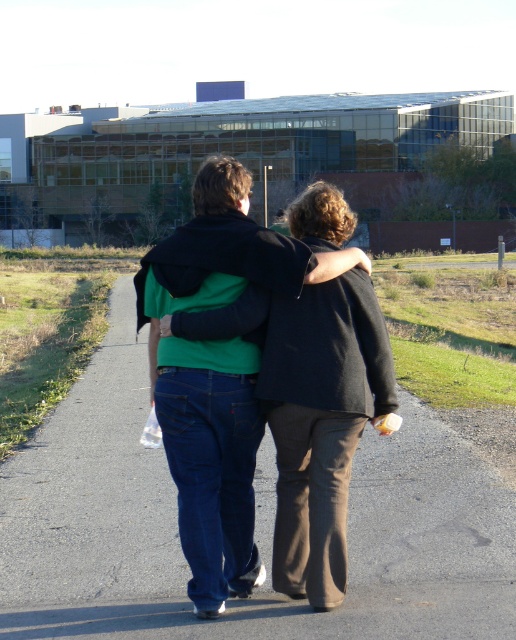
Question: Observing the image, what is the correct spatial positioning of smooth asphalt road at center in reference to green cotton hoodie at center?

Choices:
 (A) below
 (B) above

Answer: (A)

Question: From the image, what is the correct spatial relationship of smooth asphalt road at center in relation to green cotton hoodie at center?

Choices:
 (A) right
 (B) left

Answer: (A)

Question: Which point appears farthest from the camera in this image?

Choices:
 (A) (196, 198)
 (B) (158, 572)

Answer: (B)

Question: Is smooth asphalt road at center in front of green cotton hoodie at center?

Choices:
 (A) yes
 (B) no

Answer: (A)

Question: Among these objects, which one is nearest to the camera?

Choices:
 (A) green cotton hoodie at center
 (B) smooth asphalt road at center

Answer: (B)